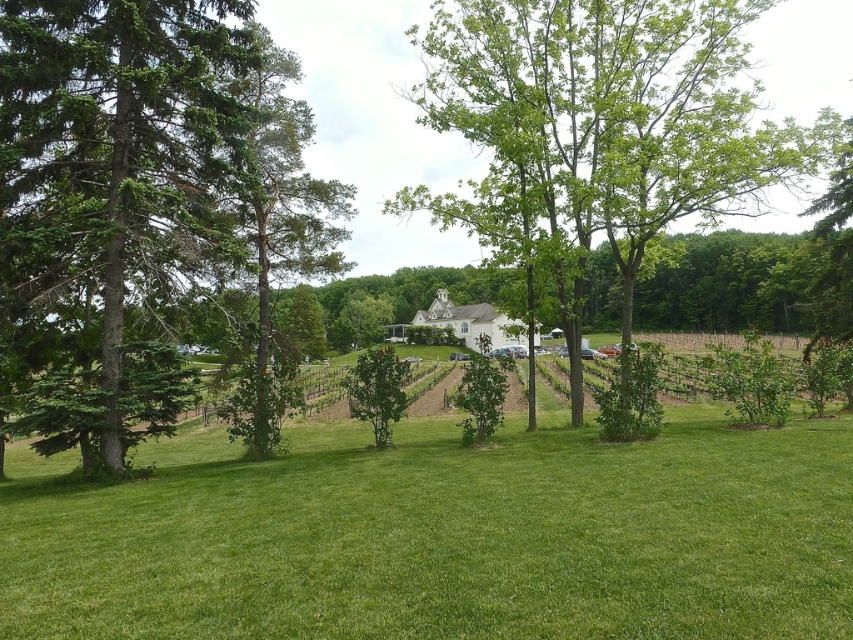
Question: Can you confirm if green leafy tree at center is positioned above green textured tree at left?

Choices:
 (A) no
 (B) yes

Answer: (B)

Question: Based on their relative distances, which object is nearer to the green coniferous tree at left?

Choices:
 (A) green leafy tree at center
 (B) green textured tree at left

Answer: (B)

Question: Which of the following is the farthest from the observer?

Choices:
 (A) green coniferous tree at left
 (B) green textured tree at left
 (C) green leafy tree at center

Answer: (C)

Question: Can you confirm if green leafy tree at center is bigger than green textured tree at left?

Choices:
 (A) yes
 (B) no

Answer: (A)

Question: Among these objects, which one is farthest from the camera?

Choices:
 (A) green textured tree at left
 (B) green leafy tree at center
 (C) green coniferous tree at left

Answer: (B)

Question: Can you confirm if green coniferous tree at left is thinner than green textured tree at left?

Choices:
 (A) yes
 (B) no

Answer: (A)